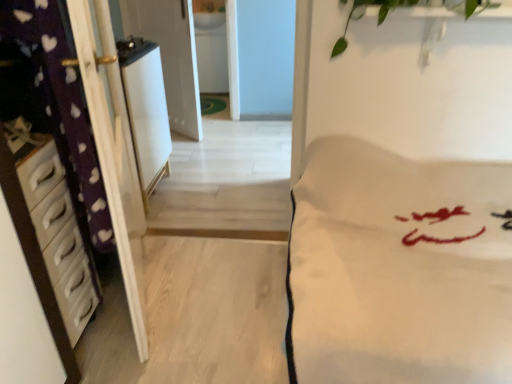
Question: Does green leafy plant at upper center have a lesser width compared to white soft fabric at center?

Choices:
 (A) no
 (B) yes

Answer: (B)

Question: From a real-world perspective, does green leafy plant at upper center stand above white soft fabric at center?

Choices:
 (A) no
 (B) yes

Answer: (B)

Question: Is green leafy plant at upper center closer to camera compared to white soft fabric at center?

Choices:
 (A) yes
 (B) no

Answer: (B)

Question: Is green leafy plant at upper center outside of white soft fabric at center?

Choices:
 (A) yes
 (B) no

Answer: (A)

Question: From a real-world perspective, is green leafy plant at upper center below white soft fabric at center?

Choices:
 (A) yes
 (B) no

Answer: (B)

Question: Considering the relative positions of green leafy plant at upper center and white soft fabric at center in the image provided, is green leafy plant at upper center to the right of white soft fabric at center from the viewer's perspective?

Choices:
 (A) yes
 (B) no

Answer: (A)

Question: Can you confirm if white plastic chest of drawers at left is wider than green leafy plant at upper center?

Choices:
 (A) no
 (B) yes

Answer: (A)

Question: Considering the relative sizes of white plastic chest of drawers at left and green leafy plant at upper center in the image provided, is white plastic chest of drawers at left bigger than green leafy plant at upper center?

Choices:
 (A) no
 (B) yes

Answer: (B)

Question: Is white plastic chest of drawers at left taller than green leafy plant at upper center?

Choices:
 (A) no
 (B) yes

Answer: (B)

Question: Could you tell me if white plastic chest of drawers at left is facing green leafy plant at upper center?

Choices:
 (A) yes
 (B) no

Answer: (A)

Question: From the image's perspective, is white plastic chest of drawers at left located above green leafy plant at upper center?

Choices:
 (A) yes
 (B) no

Answer: (B)

Question: Is green leafy plant at upper center completely or partially inside white plastic chest of drawers at left?

Choices:
 (A) no
 (B) yes

Answer: (A)

Question: Does white plastic chest of drawers at left lie behind white glossy sink at upper center?

Choices:
 (A) yes
 (B) no

Answer: (B)